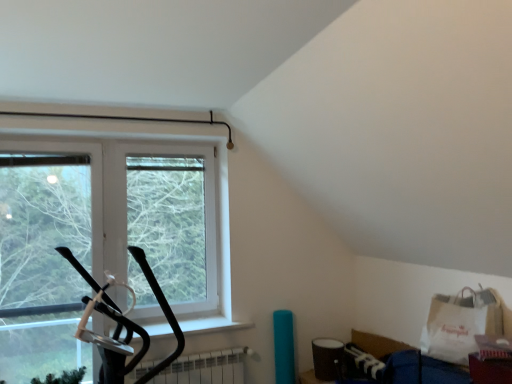
Question: From a real-world perspective, is clear glass window at center positioned above or below white matte radiator at lower center?

Choices:
 (A) below
 (B) above

Answer: (B)

Question: In terms of width, does clear glass window at center look wider or thinner when compared to white matte radiator at lower center?

Choices:
 (A) wide
 (B) thin

Answer: (B)

Question: Which object is the farthest from the white matte radiator at lower center?

Choices:
 (A) white paper grocery bag at lower right
 (B) clear glass window at center

Answer: (A)

Question: Which object is the farthest from the white matte radiator at lower center?

Choices:
 (A) white paper grocery bag at lower right
 (B) clear glass window at center

Answer: (A)